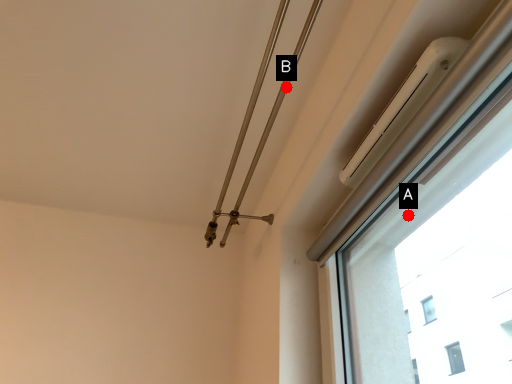
Question: Two points are circled on the image, labeled by A and B beside each circle. Which point appears farthest from the camera in this image?

Choices:
 (A) A is further
 (B) B is further

Answer: (A)